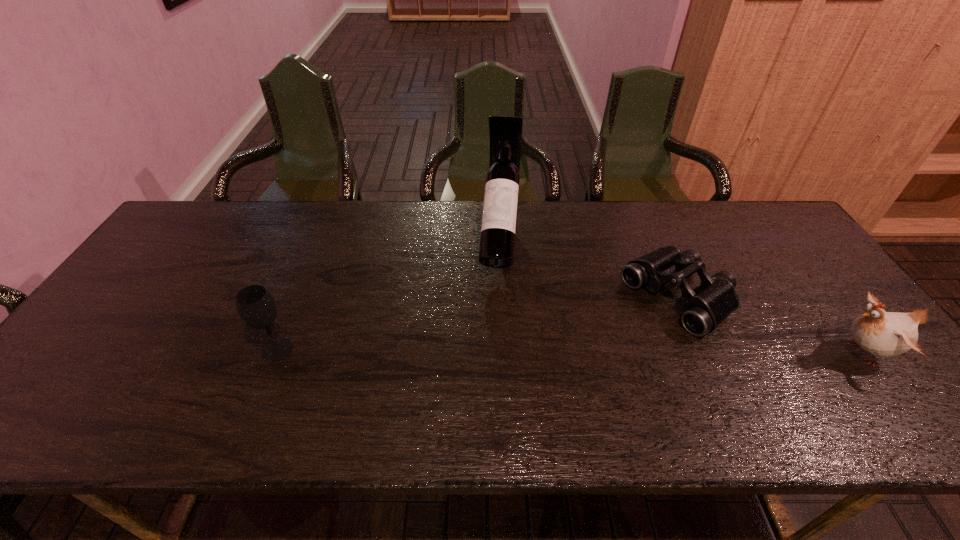
The width and height of the screenshot is (960, 540). In order to click on the leftmost object in this screenshot , I will do `click(256, 306)`.

Find the location of a particular element. This screenshot has width=960, height=540. bird is located at coordinates (884, 334).

Where is `the second object from left to right`? This screenshot has height=540, width=960. the second object from left to right is located at coordinates (498, 230).

Locate an element on the screen. The image size is (960, 540). the tallest object is located at coordinates (498, 230).

Identify the location of binoculars. (703, 309).

Where is `the third object from left to right`? This screenshot has width=960, height=540. the third object from left to right is located at coordinates (703, 309).

The width and height of the screenshot is (960, 540). I want to click on vacant space located on the left of the wineglass, so click(176, 349).

Identify the location of vacant space located 0.210m at the beak of the bird. The image size is (960, 540). (743, 353).

Locate an element on the screen. The width and height of the screenshot is (960, 540). vacant space situated at the beak of the bird is located at coordinates (722, 353).

The image size is (960, 540). I want to click on vacant space located at the beak of the bird, so click(x=681, y=353).